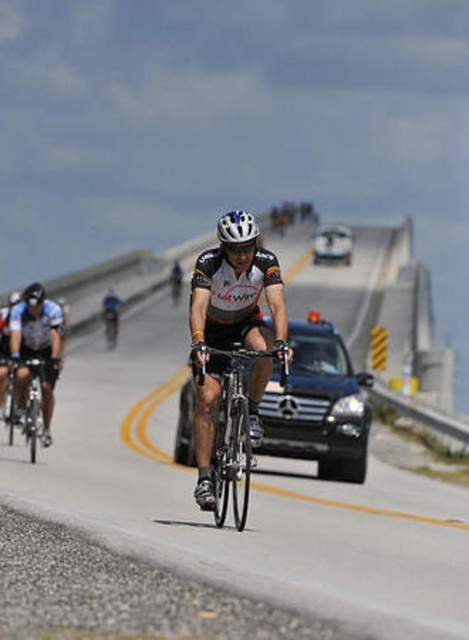
You are a photographer standing at the point marked by coordinates (234, 424) in the image. What object are you directly facing?

The point at coordinates (234, 424) is on the shiny metallic bicycle at center, so you are directly facing the shiny metallic bicycle at center.

You are a cyclist in the group and want to check your position relative to two points on the road ahead. Which point is closer to you, point (226, 404) or point (25, 344)?

Point (226, 404) is closer to the viewer than point (25, 344).